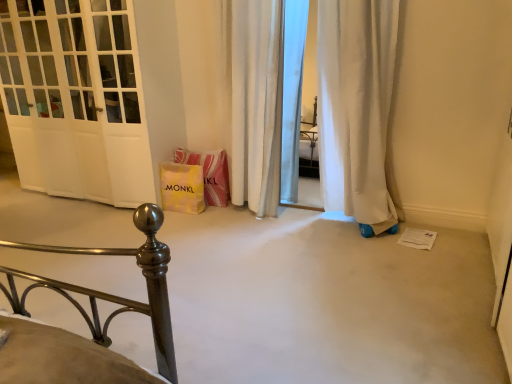
Where is `vacant area situated to the left side of white fabric curtain at center`? This screenshot has width=512, height=384. vacant area situated to the left side of white fabric curtain at center is located at coordinates (193, 223).